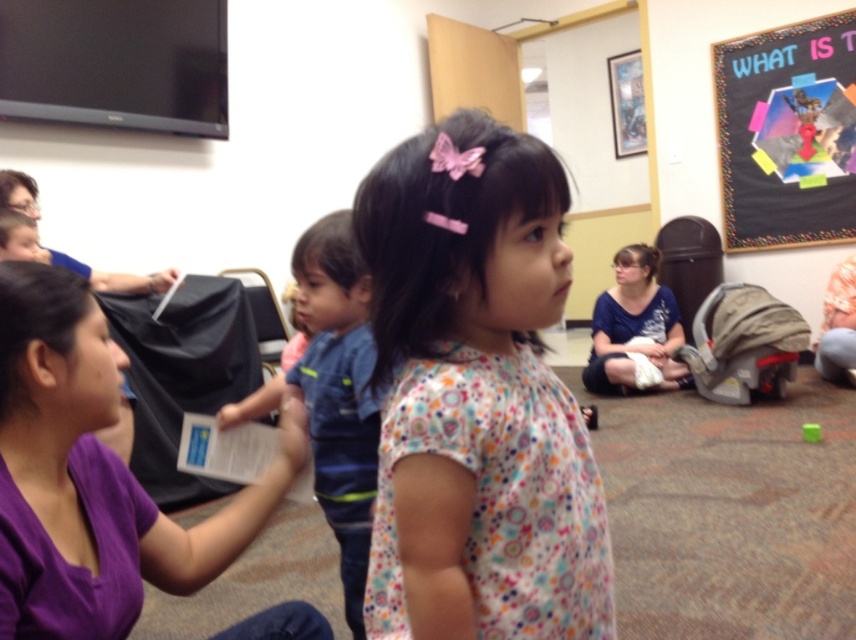
Question: Which object is farther from the camera taking this photo?

Choices:
 (A) black matte poster at upper right
 (B) blue denim overalls at center
 (C) purple fabric shirt at center

Answer: (A)

Question: Considering the relative positions of purple fabric shirt at center and blue denim overalls at center in the image provided, where is purple fabric shirt at center located with respect to blue denim overalls at center?

Choices:
 (A) right
 (B) left

Answer: (B)

Question: Can you confirm if black matte poster at upper right is smaller than blue cotton shirt at center?

Choices:
 (A) no
 (B) yes

Answer: (A)

Question: Is blue denim overalls at center closer to the viewer compared to blue cotton shirt at center?

Choices:
 (A) no
 (B) yes

Answer: (B)

Question: Which point is closer to the camera?

Choices:
 (A) (379, 493)
 (B) (780, 218)
 (C) (247, 401)

Answer: (A)

Question: Which point is farther from the camera taking this photo?

Choices:
 (A) (557, 497)
 (B) (337, 262)
 (C) (816, 42)

Answer: (C)